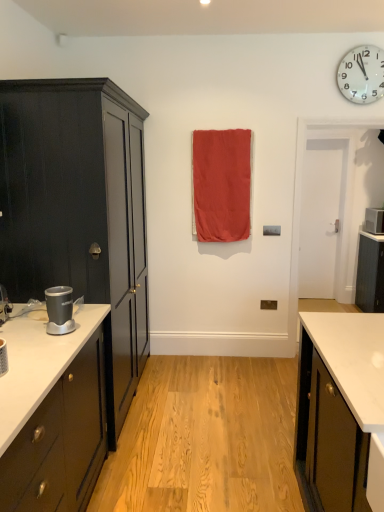
You are a GUI agent. You are given a task and a screenshot of the screen. Output one action in this format:
    pyautogui.click(x=<x>, y=<y>)
    Task: Click on the vacant point above matte red fabric at center (from a real-world perspective)
    This screenshot has height=512, width=384.
    Given the screenshot: What is the action you would take?
    pyautogui.click(x=221, y=128)